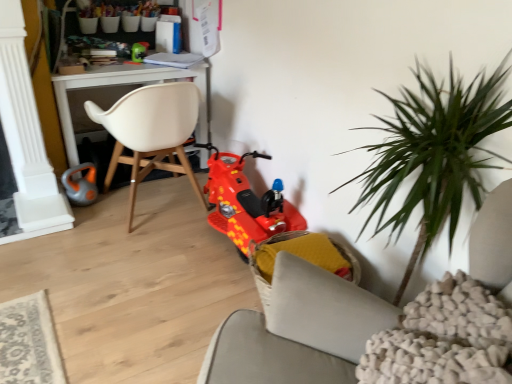
You are a GUI agent. You are given a task and a screenshot of the screen. Output one action in this format:
    pyautogui.click(x=<x>, y=<y>)
    Task: Click on the unoccupied area in front of shiny plastic scooter at center, the first toy from the bottom
    The width and height of the screenshot is (512, 384).
    Given the screenshot: What is the action you would take?
    pyautogui.click(x=197, y=280)